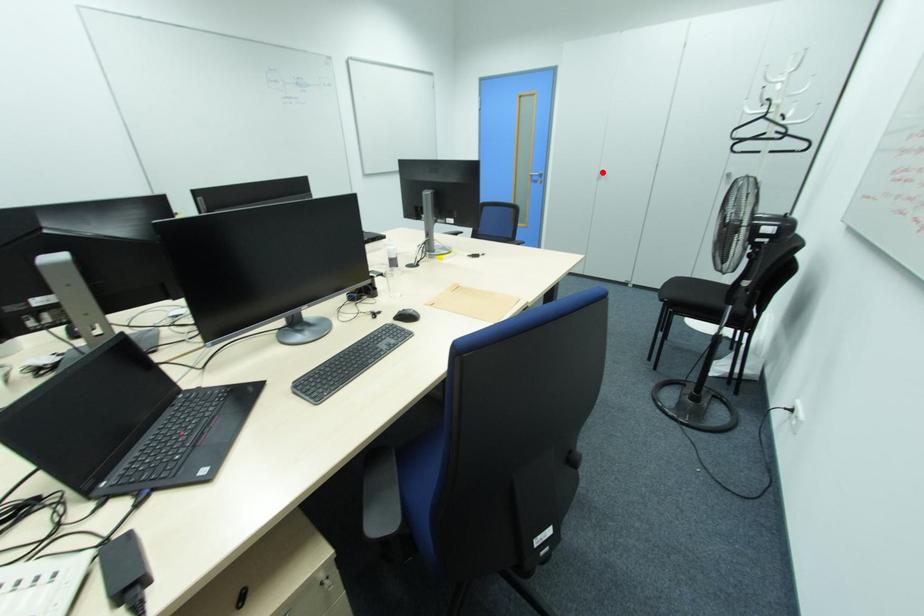
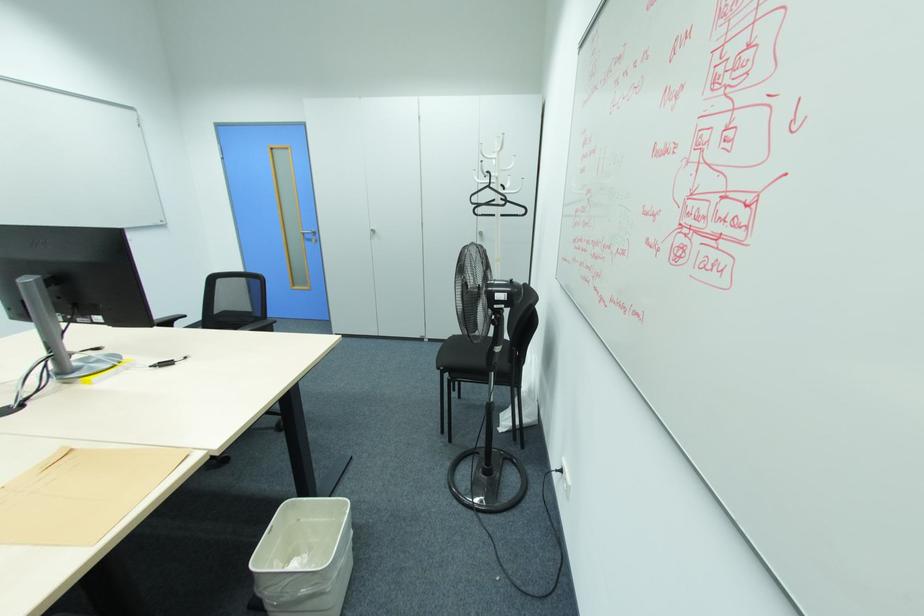
Locate, in the second image, the point that corresponds to the highlighted location in the first image.

(373, 231)